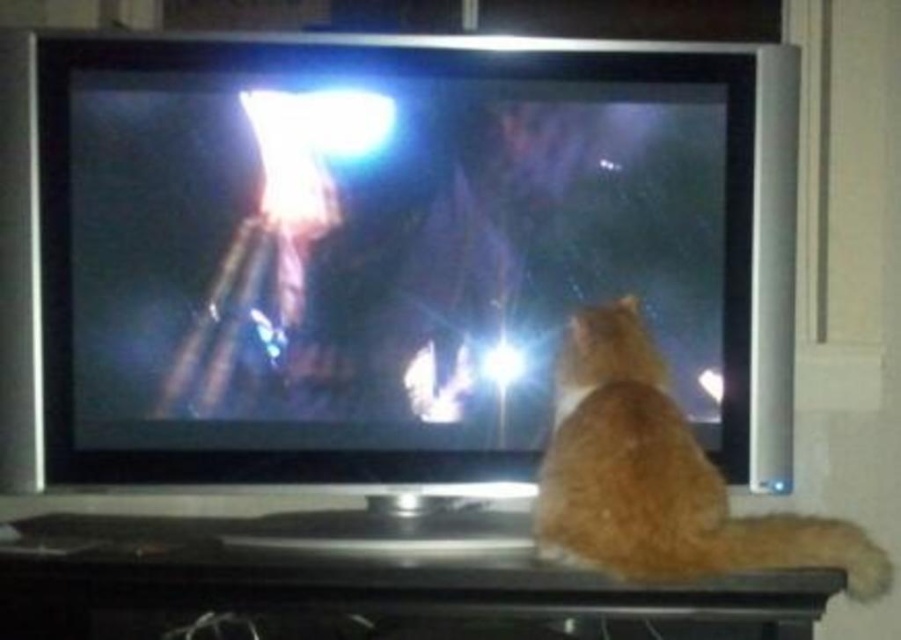
You are a delivery person who just arrived at the apartment. You need to place a new rectangular package that is 2 feet wide on the dark wooden stand in front of the TV. The stand has space between the metallic silver flat at center and the orange fur cat at lower right. Can you fit the package there without moving either object?

The metallic silver flat at center is wider than the orange fur cat at lower right. Since the package is 2 feet wide, you need to check if the space between them can accommodate its width. If the combined width of both objects plus the space between them is at least 2 feet, then it should fit. However, without exact measurements of the space, it is uncertain. Consider rearranging slightly if possible.